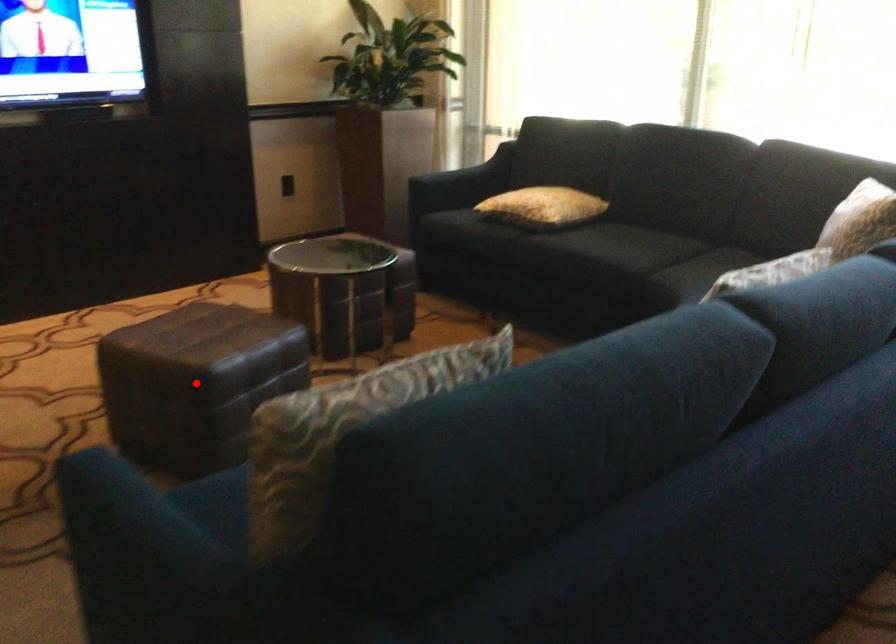
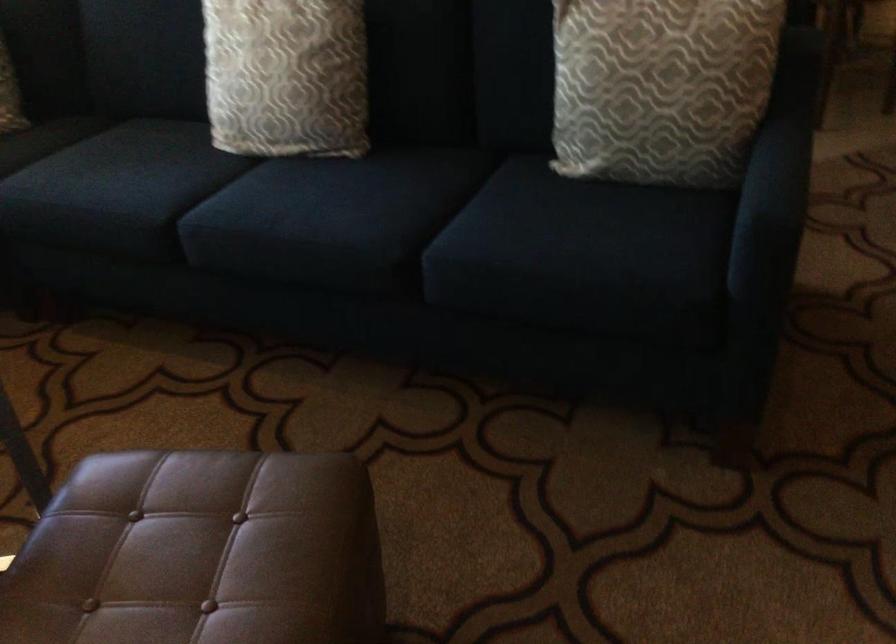
Question: I am providing you with two images of the same scene from different viewpoints. In image1, a red point is highlighted. Considering the same 3D point in image2, which of the following is correct?

Choices:
 (A) It is closer
 (B) It is farther

Answer: (A)